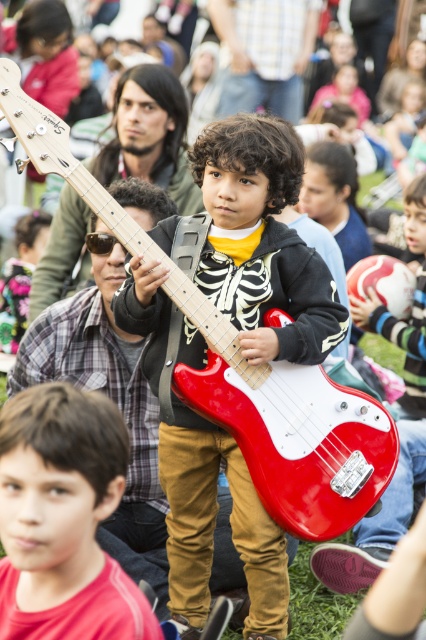
Based on the photo, you are a photographer trying to capture the boy with the red electric guitar. You notice two points in the background marked as point (342, 492) and point (420, 307). Which point is nearer to your camera lens?

Point (342, 492) is closer to the camera than point (420, 307), so the photographer should focus on that point to ensure it appears sharper in the photo.

From the picture: You are a photographer at the event and want to capture both the matte red guitar at center and the matte black guitar at center in a single shot. Given that your camera has a focal length of 50mm and the minimum distance between objects in the frame should be at least 2 feet to avoid blurriness, can you include both guitars in your photo?

The matte red guitar at center is 6.73 feet away from the matte black guitar at center. Since the minimum required distance between objects is 2 feet, and 6.73 feet is greater than 2 feet, both guitars can be captured clearly in a single shot without blurriness.